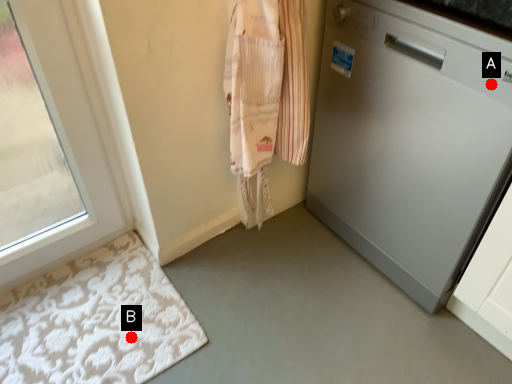
Question: Two points are circled on the image, labeled by A and B beside each circle. Which point appears farthest from the camera in this image?

Choices:
 (A) A is further
 (B) B is further

Answer: (B)